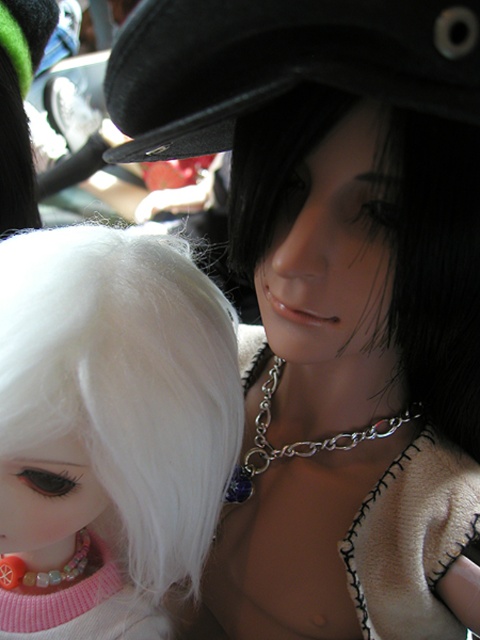
You are a parent trying to choose a toy for your baby. You see the black matte hair at center and the multicolored plastic teething ring at lower left. Which one is more suitable for a baby to chew on?

The multicolored plastic teething ring at lower left is more suitable for a baby to chew on because it is smaller than the black matte hair at center.

You are a photographer setting up a shot of the dolls. You want to ensure the silver chain at center and matte pink lips at center are both in focus. Since you can only focus on one object, which one should you focus on to capture both in the same plane?

The silver chain at center is to the right of matte pink lips at center, so focusing on either object would keep both in focus as they are positioned in the same plane.

You are a photographer trying to capture a closeup of the dolls. You want to focus on the silver chain at center and the matte pink lips at center. Which object should you zoom in more on to ensure it appears larger in the photo?

The silver chain at center is bigger than matte pink lips at center, so you should zoom in more on the silver chain at center to ensure it appears larger in the photo.